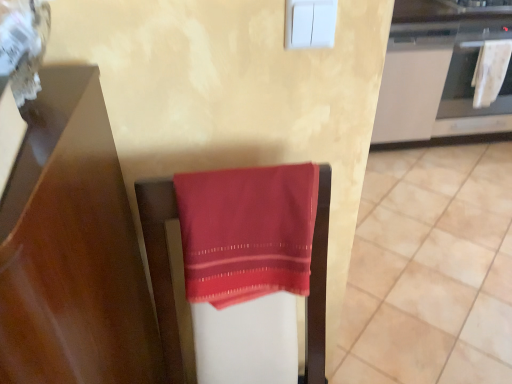
Question: Considering the relative sizes of white textured towel at right and white fabric oven at upper right in the image provided, is white textured towel at right taller than white fabric oven at upper right?

Choices:
 (A) yes
 (B) no

Answer: (B)

Question: From a real-world perspective, is white textured towel at right physically above white fabric oven at upper right?

Choices:
 (A) yes
 (B) no

Answer: (B)

Question: Can you confirm if white textured towel at right is shorter than white fabric oven at upper right?

Choices:
 (A) yes
 (B) no

Answer: (A)

Question: From the image's perspective, is white textured towel at right on white fabric oven at upper right?

Choices:
 (A) yes
 (B) no

Answer: (B)

Question: Is white textured towel at right closer to camera compared to white fabric oven at upper right?

Choices:
 (A) no
 (B) yes

Answer: (A)

Question: From a real-world perspective, is white textured towel at right physically located above or below white glossy cabinet at upper right?

Choices:
 (A) above
 (B) below

Answer: (A)

Question: From the image's perspective, is white textured towel at right located above or below white glossy cabinet at upper right?

Choices:
 (A) above
 (B) below

Answer: (B)

Question: Considering the relative positions of white textured towel at right and white glossy cabinet at upper right in the image provided, is white textured towel at right to the left or to the right of white glossy cabinet at upper right?

Choices:
 (A) left
 (B) right

Answer: (B)

Question: Is point (489, 39) positioned closer to the camera than point (390, 140)?

Choices:
 (A) farther
 (B) closer

Answer: (B)

Question: Relative to white fabric oven at upper right, is white glossy cabinet at upper right in front or behind?

Choices:
 (A) behind
 (B) front

Answer: (A)

Question: From the image's perspective, relative to white fabric oven at upper right, is white glossy cabinet at upper right above or below?

Choices:
 (A) below
 (B) above

Answer: (A)

Question: From their relative heights in the image, would you say white glossy cabinet at upper right is taller or shorter than white fabric oven at upper right?

Choices:
 (A) tall
 (B) short

Answer: (A)

Question: Based on their positions, is white glossy cabinet at upper right located to the left or right of white fabric oven at upper right?

Choices:
 (A) left
 (B) right

Answer: (A)

Question: Relative to smooth red towel at center, is white glossy cabinet at upper right in front or behind?

Choices:
 (A) behind
 (B) front

Answer: (A)

Question: Visually, is white glossy cabinet at upper right positioned to the left or to the right of smooth red towel at center?

Choices:
 (A) right
 (B) left

Answer: (B)